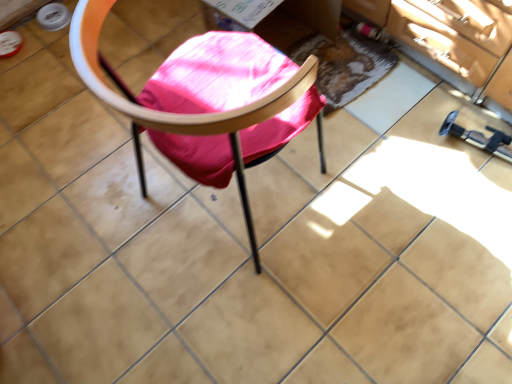
Where is `free spot in front of textured woolen mat at center`? free spot in front of textured woolen mat at center is located at coordinates (365, 144).